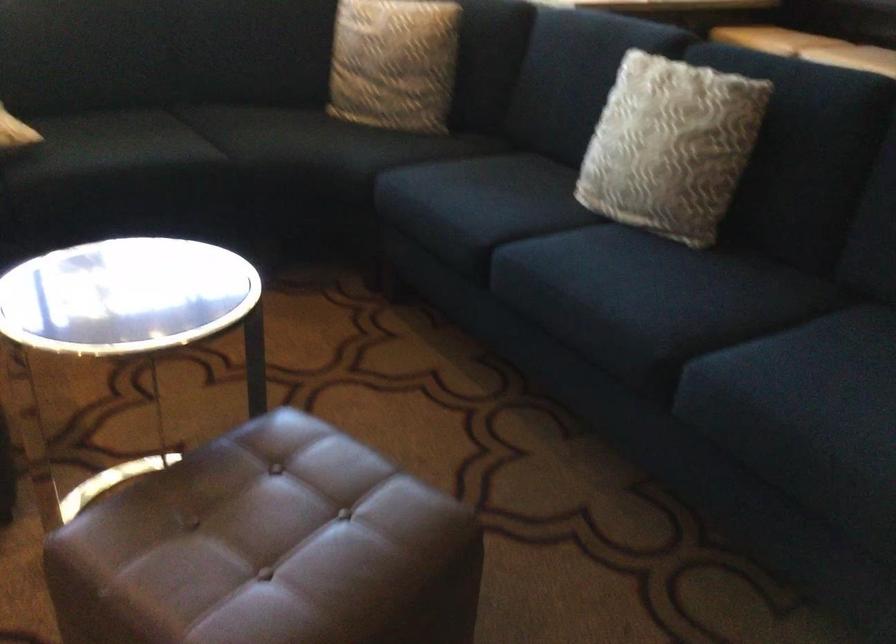
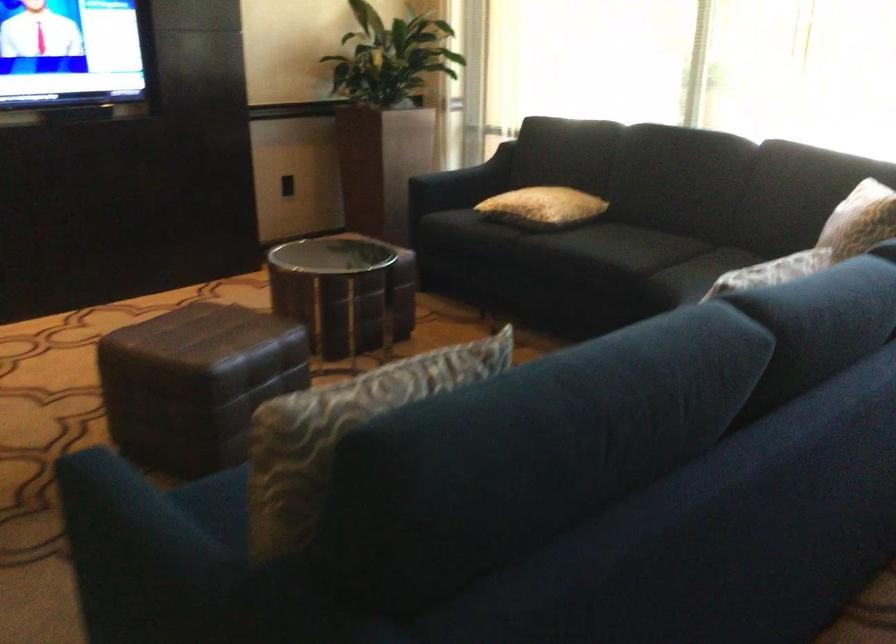
Locate, in the second image, the point that corresponds to pixel 194 142 in the first image.

(626, 254)